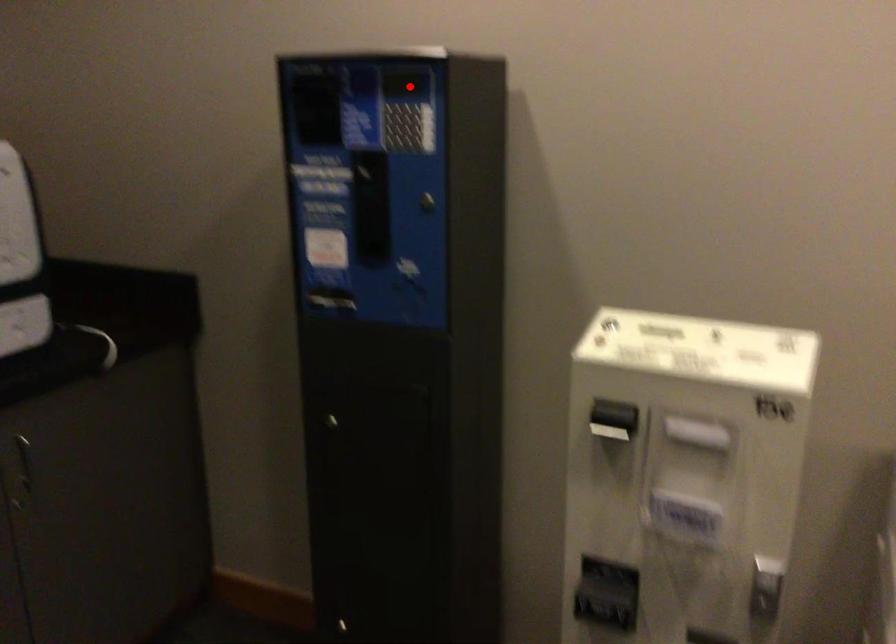
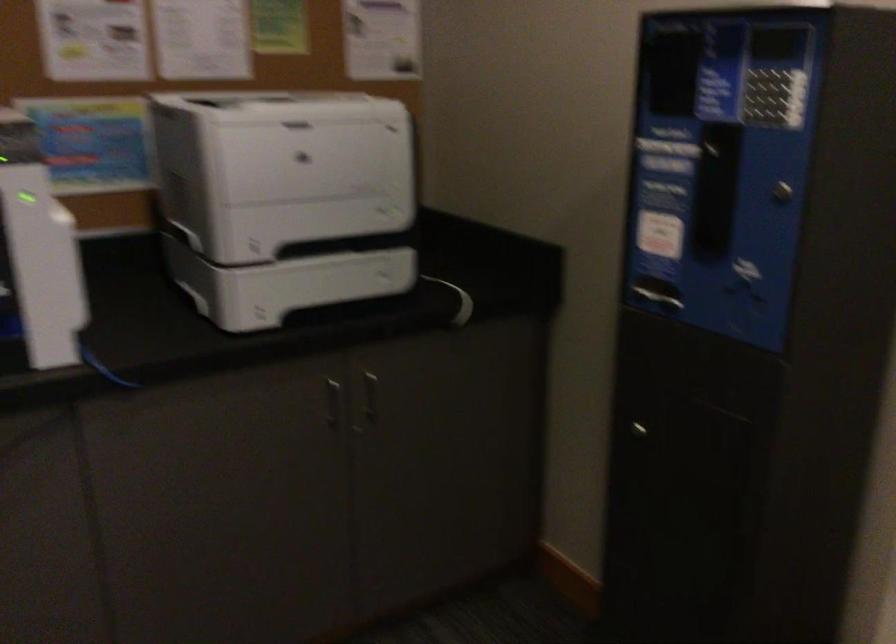
The point at the highlighted location is marked in the first image. Where is the corresponding point in the second image?

(780, 44)